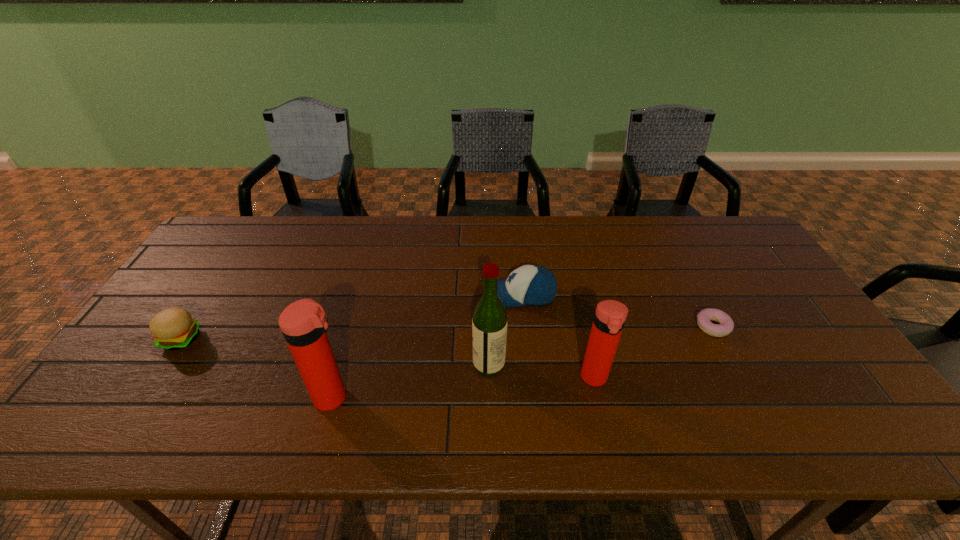
The height and width of the screenshot is (540, 960). What are the coordinates of `blank space located on the label of the liquor` in the screenshot? It's located at (442, 364).

Where is `liquor situated at the near edge`? The width and height of the screenshot is (960, 540). liquor situated at the near edge is located at coordinates (489, 323).

Find the location of a particular element. object that is at the left edge is located at coordinates (173, 328).

This screenshot has height=540, width=960. In the image, there is a desktop. What are the coordinates of `free space at the far edge` in the screenshot? It's located at (389, 253).

The height and width of the screenshot is (540, 960). I want to click on vacant space at the near edge of the desktop, so click(632, 387).

In the image, there is a desktop. Identify the location of vacant area at the left edge. (173, 370).

Identify the location of blank space at the right edge of the desktop. This screenshot has height=540, width=960. (737, 262).

The height and width of the screenshot is (540, 960). In the image, there is a desktop. In order to click on vacant space at the far right corner in this screenshot , I will do `click(723, 220)`.

You are a GUI agent. You are given a task and a screenshot of the screen. Output one action in this format:
    pyautogui.click(x=<x>, y=<y>)
    Task: Click on the vacant area between the doughnut and the second object from left to right
    The width and height of the screenshot is (960, 540).
    Given the screenshot: What is the action you would take?
    [x=522, y=362]

At what (x,y) coordinates should I click in order to perform the action: click on empty location between the fifth object from right to left and the shorter thermos bottle. Please return your answer as a coordinate pair (x, y). The image size is (960, 540). Looking at the image, I should click on (464, 388).